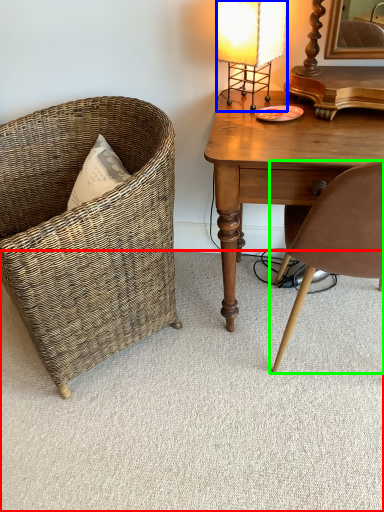
Question: Considering the real-world distances, which object is closest to plain (highlighted by a red box)? lamp (highlighted by a blue box) or chair (highlighted by a green box).

Choices:
 (A) lamp
 (B) chair

Answer: (B)